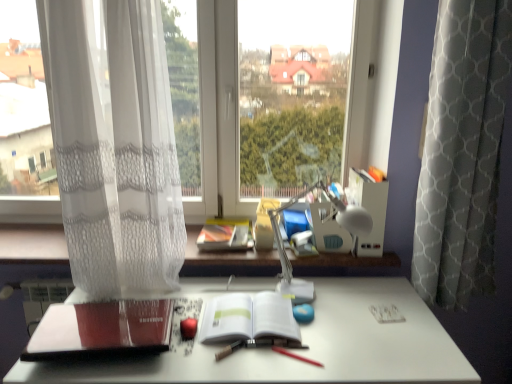
Identify the location of vacant region under white plastic table lamp at center (from a real-world perspective). (x=325, y=301).